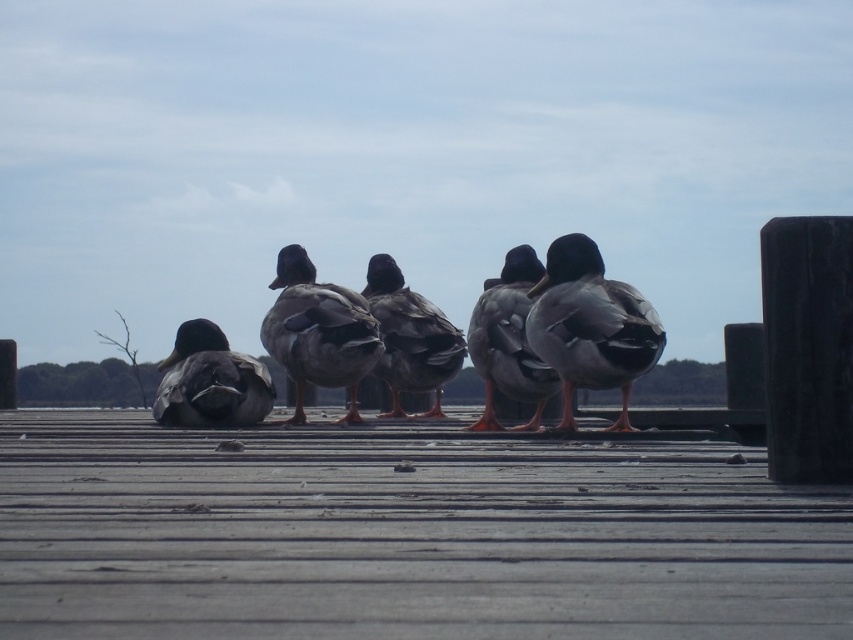
Is the position of wooden planks at center more distant than that of brown feathered duck at center?

That is False.

Is point (834, 573) farther from viewer compared to point (311, 380)?

No, (834, 573) is in front of (311, 380).

Does point (107, 628) lie behind point (302, 385)?

No, it is not.

Where is `wooden planks at center`? This screenshot has width=853, height=640. wooden planks at center is located at coordinates (404, 536).

Is brown feathered duck at center closer to camera compared to gray matte duck at center?

That is False.

Who is more forward, (347, 358) or (514, 358)?

Point (514, 358)

The image size is (853, 640). I want to click on brown feathered duck at center, so click(x=318, y=332).

Which of these two, gray matte duck at center or dark gray matte duck at left, stands taller?

Standing taller between the two is gray matte duck at center.

Does gray matte duck at center appear on the left side of dark gray matte duck at left?

A: Incorrect, gray matte duck at center is not on the left side of dark gray matte duck at left.

Who is more forward, (537, 413) or (189, 332)?

Point (537, 413) is in front.

Image resolution: width=853 pixels, height=640 pixels. Find the location of `gray matte duck at center`. gray matte duck at center is located at coordinates (508, 340).